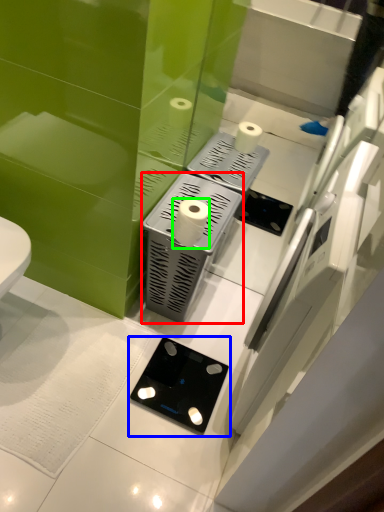
Question: Which object is positioned closest to appliance (highlighted by a red box)? Select from gadget (highlighted by a blue box) and toilet paper (highlighted by a green box).

Choices:
 (A) gadget
 (B) toilet paper

Answer: (B)